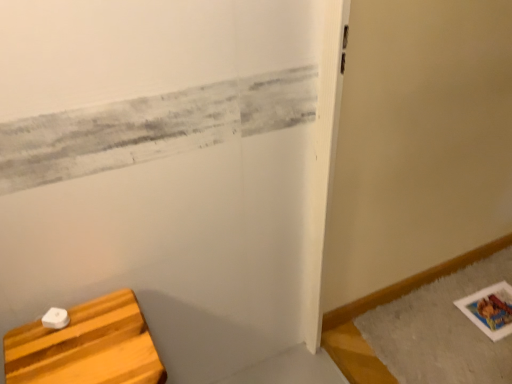
I want to click on vacant space underneath gray fluffy bath mat at lower right (from a real-world perspective), so click(x=455, y=330).